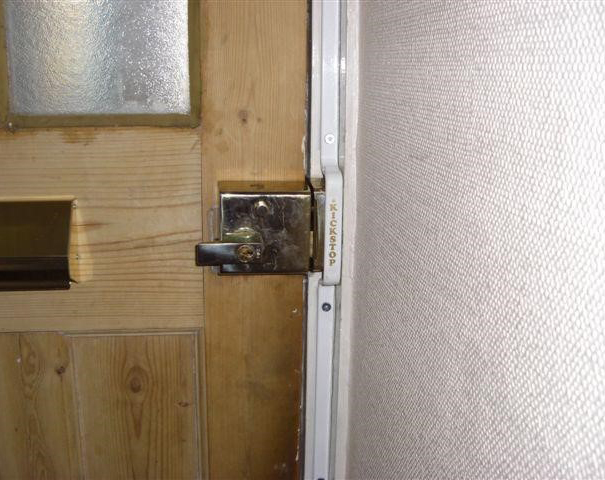
Identify the location of wall. This screenshot has width=605, height=480. (397, 93).